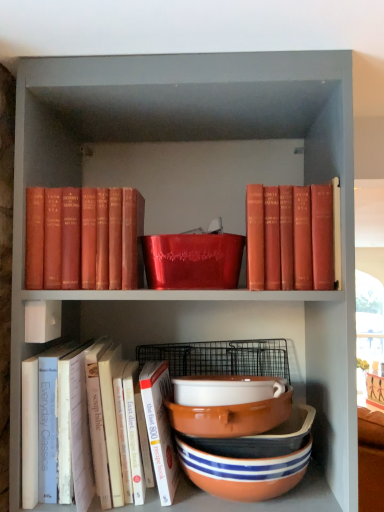
Question: Considering their positions, is striped ceramic bowls at lower center, which appears as the second bowl when viewed from the top, located in front of or behind terracotta ceramic bowl at lower center, arranged as the 1th bowl when ordered from the bottom?

Choices:
 (A) front
 (B) behind

Answer: (B)

Question: From a real-world perspective, relative to terracotta ceramic bowl at lower center, arranged as the 1th bowl when ordered from the bottom, is striped ceramic bowls at lower center, which appears as the second bowl when viewed from the top, vertically above or below?

Choices:
 (A) below
 (B) above

Answer: (B)

Question: Which of these objects is positioned closest to the striped ceramic bowls at lower center, which is the second bowl from bottom to top?

Choices:
 (A) terracotta ceramic bowl at lower center, the 3th bowl in the top-to-bottom sequence
 (B) matte red book at upper left, arranged as the second book when viewed from the top
 (C) white paper book at lower left, which appears as the 2th book when viewed from the right
 (D) matte red book at upper right, acting as the third book starting from the bottom
 (E) white ceramic bowl at center, which is counted as the 1th bowl, starting from the top

Answer: (A)

Question: Estimate the real-world distances between objects in this image. Which object is closer to the matte red book at upper right, acting as the third book starting from the bottom?

Choices:
 (A) white paper book at lower left, which appears as the 2th book when viewed from the right
 (B) white ceramic bowl at center, which is counted as the 1th bowl, starting from the top
 (C) terracotta ceramic bowl at lower center, the 3th bowl in the top-to-bottom sequence
 (D) striped ceramic bowls at lower center, which is the second bowl from bottom to top
 (E) matte red book at upper left, positioned as the 1th book in left-to-right order

Answer: (B)